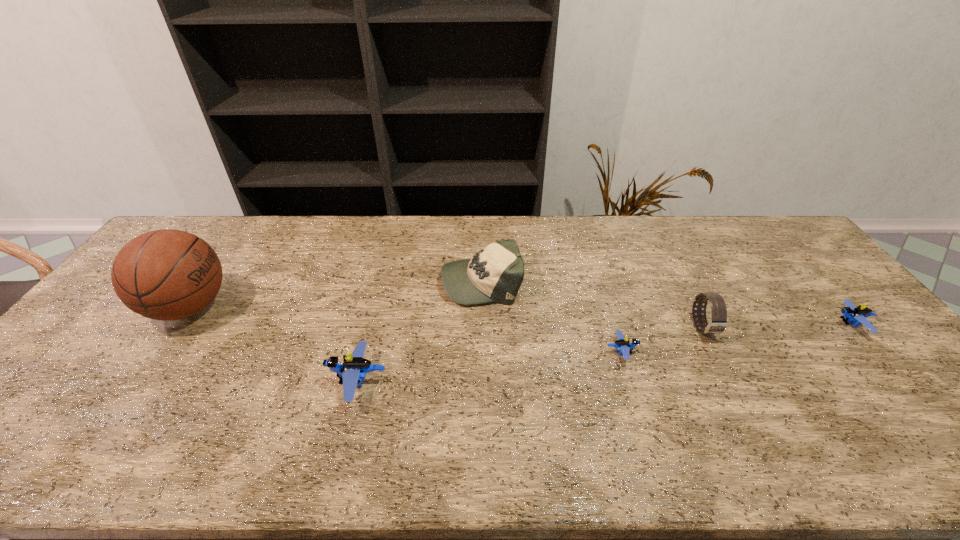
This screenshot has width=960, height=540. Find the location of `the second object from left to right`. the second object from left to right is located at coordinates (354, 368).

I want to click on the leftmost Lego, so [x=354, y=368].

Find the location of a particular element. Image resolution: width=960 pixels, height=540 pixels. the second Lego from right to left is located at coordinates (623, 345).

You are a GUI agent. You are given a task and a screenshot of the screen. Output one action in this format:
    pyautogui.click(x=<x>, y=<y>)
    Task: Click on the third object from right to left
    Image resolution: width=960 pixels, height=540 pixels.
    Given the screenshot: What is the action you would take?
    pyautogui.click(x=623, y=345)

Image resolution: width=960 pixels, height=540 pixels. Find the location of `the fifth tallest object`. the fifth tallest object is located at coordinates (851, 313).

Locate an element on the screen. the rightmost Lego is located at coordinates (851, 313).

The width and height of the screenshot is (960, 540). What are the coordinates of `the third object from left to right` in the screenshot? It's located at pyautogui.click(x=494, y=274).

This screenshot has width=960, height=540. I want to click on the tallest object, so click(167, 274).

This screenshot has height=540, width=960. In order to click on basketball in this screenshot , I will do `click(167, 274)`.

Locate an element on the screen. The height and width of the screenshot is (540, 960). watch is located at coordinates [x=718, y=322].